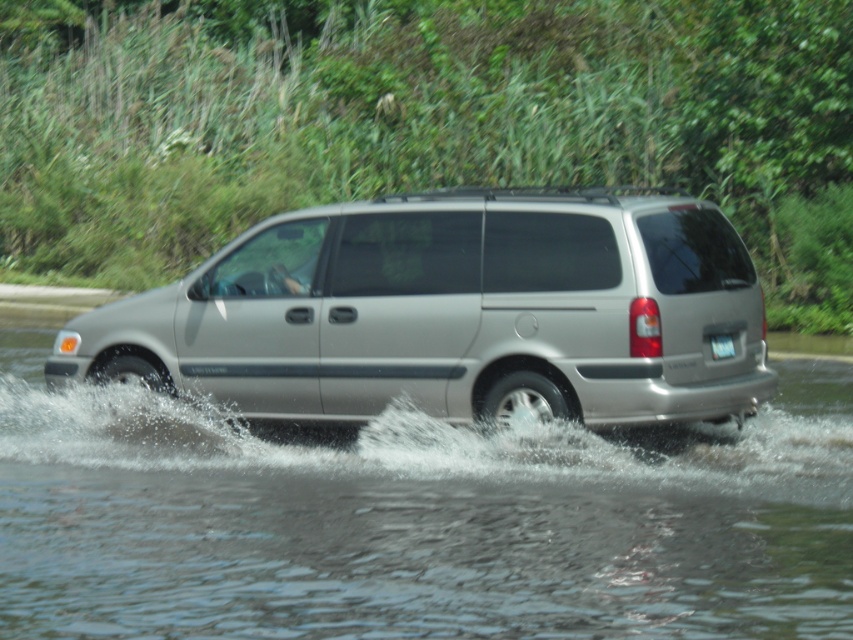
In the scene shown: You are a delivery driver who needs to park the satin silver van at center in a parking spot that is exactly the width of the white plastic license plate at rear. Can the van fit into the parking spot without touching the sides?

The satin silver van at center might be wider than the white plastic license plate at rear, so it may not fit into the parking spot without touching the sides.

You are a passenger in the silver minivan and want to look out the window to see both the clear water at lower center and the white plastic license plate at rear. Which object will appear larger in your view?

The clear water at lower center will appear larger in your view because it is closer to you than the white plastic license plate at rear.

You are a driver who needs to check your license plate for inspection. You notice the white plastic license plate at rear is partially submerged in water. Can you safely reach it while the silver minivan is still in the clear water at lower center?

The clear water at lower center is bigger than the white plastic license plate at rear, so the license plate may still be accessible. However, since the minivan is driving through water, you should ensure the water level isn